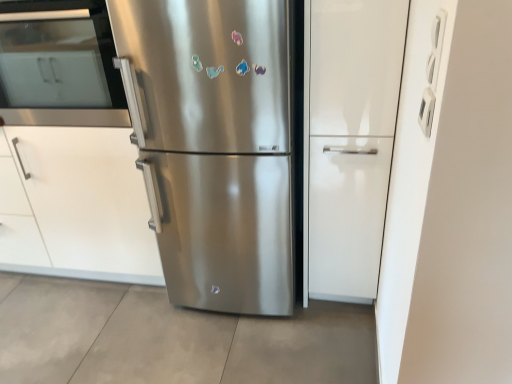
This screenshot has width=512, height=384. Describe the element at coordinates (214, 145) in the screenshot. I see `stainless steel refrigerator at center` at that location.

What do you see at coordinates (59, 65) in the screenshot?
I see `stainless steel oven at left` at bounding box center [59, 65].

Identify the location of white matte cabinet at left. (75, 205).

Where is `stainless steel refrigerator at center`? stainless steel refrigerator at center is located at coordinates (214, 145).

Is the position of stainless steel refrigerator at center less distant than that of stainless steel oven at left?

Yes, it is in front of stainless steel oven at left.

Consider the image. Which object is thinner, stainless steel refrigerator at center or stainless steel oven at left?

Thinner between the two is stainless steel oven at left.

Is stainless steel refrigerator at center bigger than stainless steel oven at left?

Yes, stainless steel refrigerator at center is bigger than stainless steel oven at left.

What's the angular difference between stainless steel refrigerator at center and stainless steel oven at left's facing directions?

stainless steel refrigerator at center and stainless steel oven at left are facing 0.422 degrees away from each other.

At what (x,y) coordinates should I click in order to perform the action: click on cabinetry on the left of stainless steel oven at left. Please return your answer as a coordinate pair (x, y). Looking at the image, I should click on (75, 205).

Considering the relative sizes of stainless steel oven at left and white matte cabinet at left in the image provided, is stainless steel oven at left wider than white matte cabinet at left?

No, stainless steel oven at left is not wider than white matte cabinet at left.

How different are the orientations of stainless steel oven at left and white matte cabinet at left in degrees?

There is a 0.0238-degree angle between the facing directions of stainless steel oven at left and white matte cabinet at left.

Is stainless steel oven at left not close to white matte cabinet at left?

That's not correct — stainless steel oven at left is a little close to white matte cabinet at left.

Considering the positions of points (403, 21) and (99, 253), is point (403, 21) farther from camera compared to point (99, 253)?

No, (403, 21) is closer to viewer.

From a real-world perspective, is white glossy cabinet at center physically located above or below white matte cabinet at left?

Clearly, from a real-world perspective, white glossy cabinet at center is above white matte cabinet at left.

Is white glossy cabinet at center next to white matte cabinet at left and touching it?

No.

Is white glossy cabinet at center located outside white matte cabinet at left?

Yes, white glossy cabinet at center is not within white matte cabinet at left.

Is point (334, 268) in front of point (215, 267)?

No, (334, 268) is further to viewer.

Is white glossy cabinet at center facing towards stainless steel refrigerator at center?

No, white glossy cabinet at center does not turn towards stainless steel refrigerator at center.

I want to click on refrigerator that appears in front of the white glossy cabinet at center, so [214, 145].

Is stainless steel oven at left taller than white glossy cabinet at center?

No.

This screenshot has width=512, height=384. I want to click on glass door lying in front of the stainless steel oven at left, so click(351, 141).

Is stainless steel oven at left positioned with its back to white glossy cabinet at center?

stainless steel oven at left does not have its back to white glossy cabinet at center.

Is stainless steel oven at left not near white glossy cabinet at center?

Absolutely, stainless steel oven at left is distant from white glossy cabinet at center.

In the scene shown: Could you tell me if white matte cabinet at left is facing white glossy cabinet at center?

No, white matte cabinet at left does not turn towards white glossy cabinet at center.

Is white matte cabinet at left further to the viewer compared to white glossy cabinet at center?

Yes, the depth of white matte cabinet at left is greater than that of white glossy cabinet at center.

From a real-world perspective, does white matte cabinet at left sit lower than white glossy cabinet at center?

Correct, in the physical world, white matte cabinet at left is lower than white glossy cabinet at center.

Considering the sizes of objects white matte cabinet at left and white glossy cabinet at center in the image provided, who is wider, white matte cabinet at left or white glossy cabinet at center?

white matte cabinet at left.

Between stainless steel oven at left and stainless steel refrigerator at center, which one has larger size?

With larger size is stainless steel refrigerator at center.

From a real-world perspective, does stainless steel oven at left sit lower than stainless steel refrigerator at center?

Actually, stainless steel oven at left is physically above stainless steel refrigerator at center in the real world.

Looking at this image, how distant is stainless steel oven at left from stainless steel refrigerator at center?

stainless steel oven at left and stainless steel refrigerator at center are 21.17 inches apart from each other.

Between stainless steel oven at left and stainless steel refrigerator at center, which one appears on the right side from the viewer's perspective?

stainless steel refrigerator at center is more to the right.

Locate an element on the screen. Image resolution: width=512 pixels, height=384 pixels. oven that appears on the left of stainless steel refrigerator at center is located at coordinates (59, 65).

Locate an element on the screen. cabinetry behind the stainless steel oven at left is located at coordinates (75, 205).

Estimate the real-world distances between objects in this image. Which object is closer to stainless steel oven at left, white matte cabinet at left or white glossy cabinet at center?

white matte cabinet at left lies closer to stainless steel oven at left than the other object.

Estimate the real-world distances between objects in this image. Which object is closer to white glossy cabinet at center, white matte cabinet at left or stainless steel refrigerator at center?

stainless steel refrigerator at center.

From the image, which object appears to be nearer to stainless steel refrigerator at center, white glossy cabinet at center or stainless steel oven at left?

white glossy cabinet at center lies closer to stainless steel refrigerator at center than the other object.

From the image, which object appears to be farther from white glossy cabinet at center, stainless steel refrigerator at center or white matte cabinet at left?

white matte cabinet at left is positioned further to the anchor white glossy cabinet at center.

From the picture: Which object lies nearer to the anchor point white matte cabinet at left, stainless steel refrigerator at center or stainless steel oven at left?

Based on the image, stainless steel oven at left appears to be nearer to white matte cabinet at left.

From the image, which object appears to be farther from white glossy cabinet at center, stainless steel oven at left or white matte cabinet at left?

stainless steel oven at left.

When comparing their distances from stainless steel oven at left, does stainless steel refrigerator at center or white matte cabinet at left seem closer?

Based on the image, white matte cabinet at left appears to be nearer to stainless steel oven at left.

When comparing their distances from white matte cabinet at left, does white glossy cabinet at center or stainless steel oven at left seem further?

white glossy cabinet at center is positioned further to the anchor white matte cabinet at left.

Identify the location of oven between white matte cabinet at left and white glossy cabinet at center in the horizontal direction. click(x=59, y=65).

Where is `refrigerator situated between white matte cabinet at left and white glossy cabinet at center from left to right`? This screenshot has height=384, width=512. refrigerator situated between white matte cabinet at left and white glossy cabinet at center from left to right is located at coordinates (214, 145).

At what (x,y) coordinates should I click in order to perform the action: click on oven between white matte cabinet at left and stainless steel refrigerator at center from left to right. Please return your answer as a coordinate pair (x, y). The height and width of the screenshot is (384, 512). Looking at the image, I should click on (59, 65).

Identify the location of refrigerator between stainless steel oven at left and white glossy cabinet at center from left to right. (214, 145).